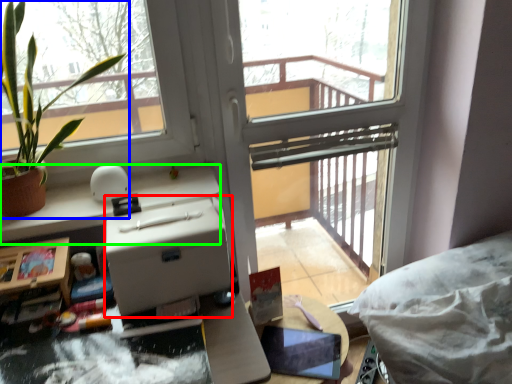
Question: Which object is the farthest from cardboard box (highlighted by a red box)? Choose among these: houseplant (highlighted by a blue box) or counter top (highlighted by a green box).

Choices:
 (A) houseplant
 (B) counter top

Answer: (A)